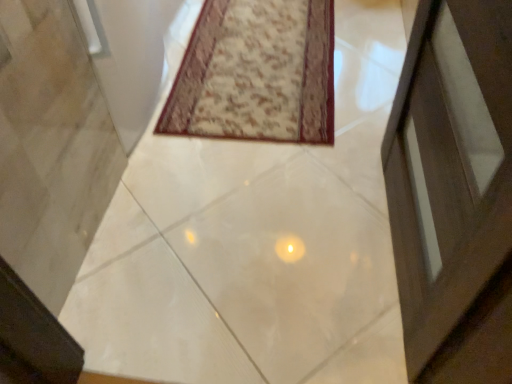
Where is `blank space situated above beige textured rug at center (from a real-world perspective)`? This screenshot has width=512, height=384. blank space situated above beige textured rug at center (from a real-world perspective) is located at coordinates (267, 59).